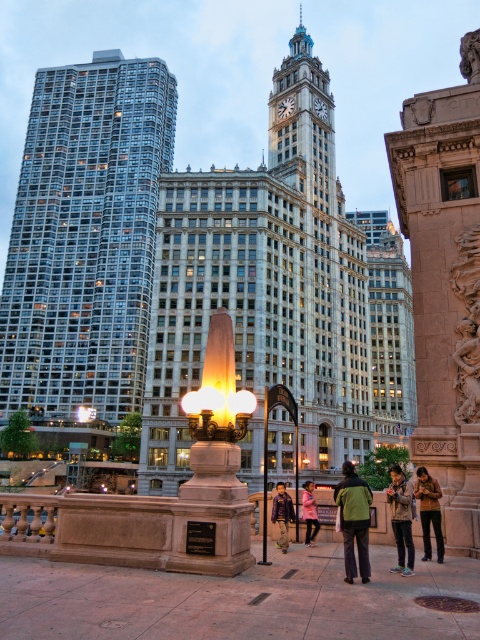
You are a tourist in the city and want to take a photo of both the white marble clock tower at center and the pink fabric jacket at center. Since you want the clock tower to appear larger in the photo than the jacket, where should you position yourself relative to them?

The white marble clock tower at center is already bigger than the pink fabric jacket at center. To ensure the clock tower appears larger in the photo, you can stand closer to the white marble clock tower at center or farther away from the pink fabric jacket at center, as proximity to the larger object emphasizes its size relative to the smaller one.

You are a tourist standing in the city square and see the white marble clock tower at center and the pink fabric jacket at center. Which object is located to the left of the other?

The white marble clock tower at center is positioned on the left side of pink fabric jacket at center, so it is to the left of the pink fabric jacket at center.

You are a city planner assessing the layout of this urban area. The city has a regulation stating that all public monuments must be at least 100 feet away from any pedestrian gathering spots to ensure safety. Given the current distance between the white marble clock tower at center and the pink fabric jacket at center, does this arrangement comply with the regulation?

The distance between the white marble clock tower at center and the pink fabric jacket at center is 95.47 feet, which is less than the required 100 feet. Therefore, this arrangement does not comply with the regulation.